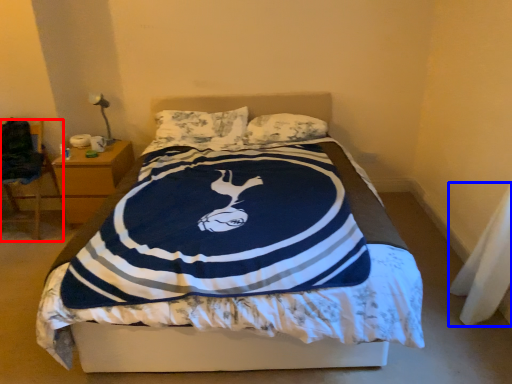
Question: Which object appears closest to the camera in this image, chair (highlighted by a red box) or material (highlighted by a blue box)?

Choices:
 (A) chair
 (B) material

Answer: (B)